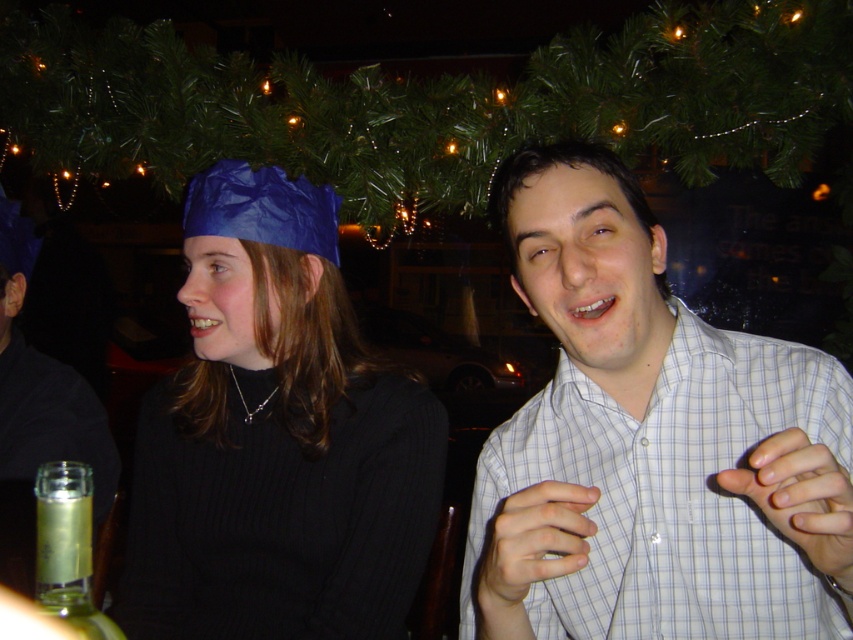
You are a photographer setting up for a group photo. You have to ensure that the matte black shirt at center and the clear glass bottle at lower left are both in focus. Given that the camera can only focus on objects of similar height, will you need to adjust the camera settings?

The matte black shirt at center is much taller than the clear glass bottle at lower left, so the camera may struggle to focus on both simultaneously. Adjust the settings or position to ensure both are at a similar height for proper focus.

You are a photographer trying to capture a candid shot of the matte black shirt at center without including the matte blue paper hat at upper left in the frame. Based on their positions, is this possible?

The matte blue paper hat at upper left is to the right of the matte black shirt at center, so positioning the camera to the left side of the matte black shirt at center might exclude the hat from the frame.

You are at a party and want to grab a drink from the clear glass bottle at lower left. However, there is a matte black shirt at center in the way. Can you reach the bottle without moving the shirt?

The matte black shirt at center is positioned on the left side of the clear glass bottle at lower left, so the shirt is blocking the path to the bottle. You would need to move the shirt to access the bottle.